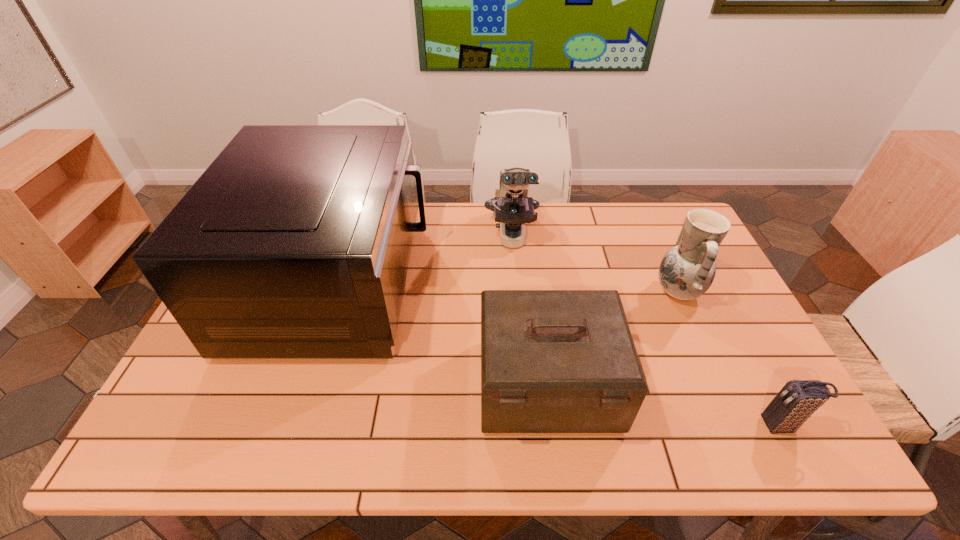
Where is `clutch bag present at the right edge`? This screenshot has height=540, width=960. clutch bag present at the right edge is located at coordinates (798, 399).

Where is `object that is at the far left corner`? Image resolution: width=960 pixels, height=540 pixels. object that is at the far left corner is located at coordinates (295, 243).

Locate an element on the screen. object situated at the near right corner is located at coordinates (798, 399).

This screenshot has width=960, height=540. In order to click on free space at the far edge of the desktop in this screenshot , I will do `click(472, 241)`.

You are a GUI agent. You are given a task and a screenshot of the screen. Output one action in this format:
    pyautogui.click(x=<x>, y=<y>)
    Task: Click on the vacant space at the near edge
    
    Given the screenshot: What is the action you would take?
    pyautogui.click(x=284, y=434)

In the image, there is a desktop. Where is `free space at the right edge`? The width and height of the screenshot is (960, 540). free space at the right edge is located at coordinates (718, 288).

The image size is (960, 540). Identify the location of vacant area at the far right corner. (668, 205).

The width and height of the screenshot is (960, 540). Find the location of `free point between the first-aid kit and the leftmost object`. free point between the first-aid kit and the leftmost object is located at coordinates 443,334.

The width and height of the screenshot is (960, 540). What are the coordinates of `empty space that is in between the shortest object and the pottery` in the screenshot? It's located at (729, 359).

Identify the location of vacant point located between the microscope and the pottery. (595, 265).